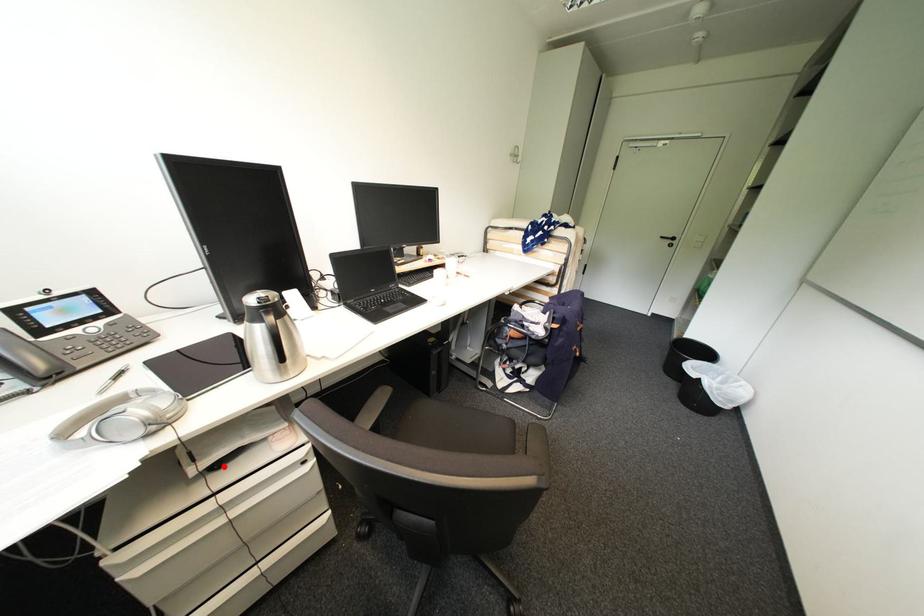
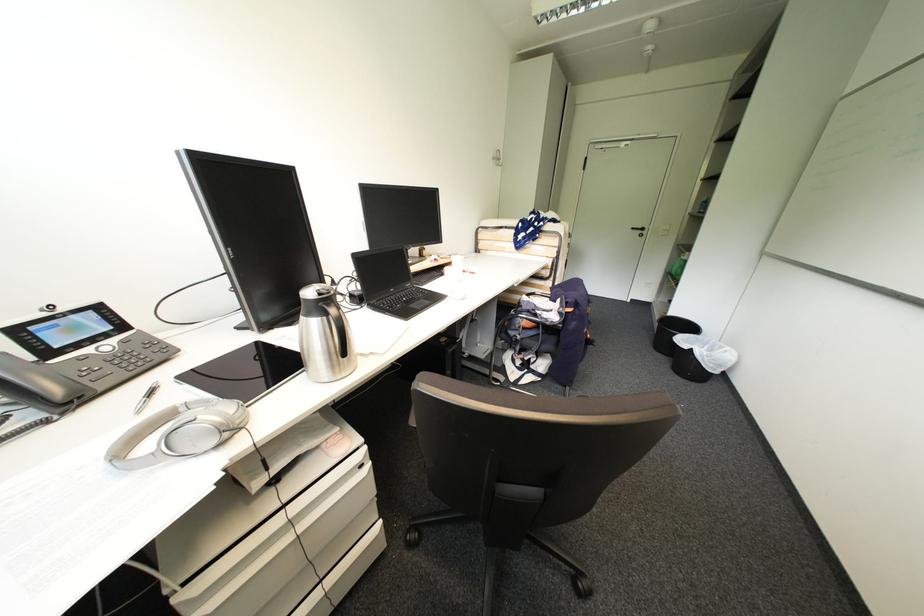
Locate, in the second image, the point that corresponds to the highlighted location in the first image.

(283, 480)